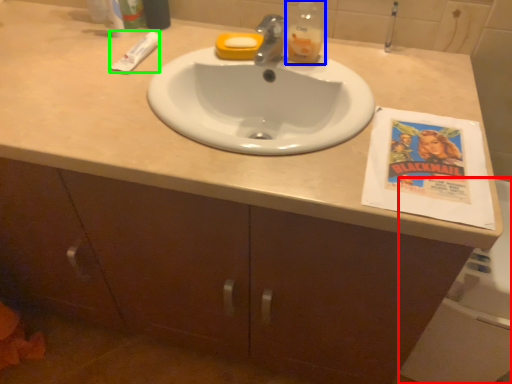
Question: Based on their relative distances, which object is farther from bath (highlighted by a red box)? Choose from bottle (highlighted by a blue box) and toothpaste (highlighted by a green box).

Choices:
 (A) bottle
 (B) toothpaste

Answer: (B)